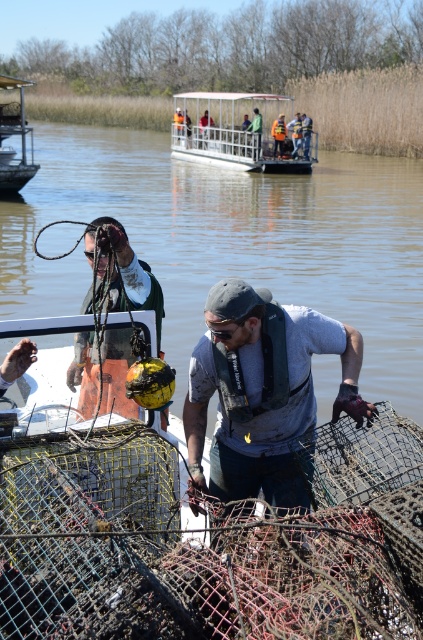
Question: Is white plastic boat at upper center below brushed metal boat at upper left?

Choices:
 (A) yes
 (B) no

Answer: (B)

Question: Does brown mesh net at center have a larger size compared to yellow-green rubber buoy at center?

Choices:
 (A) yes
 (B) no

Answer: (A)

Question: Can you confirm if white plastic boat at upper center is wider than orange life vest at center?

Choices:
 (A) no
 (B) yes

Answer: (B)

Question: Which of the following is the closest to the observer?

Choices:
 (A) (247, 422)
 (B) (7, 188)
 (C) (241, 253)
 (D) (106, 234)

Answer: (D)

Question: Which point appears farthest from the camera in this image?

Choices:
 (A) (206, 353)
 (B) (151, 168)

Answer: (B)

Question: Which of the following is the farthest from the observer?

Choices:
 (A) gray fabric shirt at center
 (B) brown mesh net at center

Answer: (B)